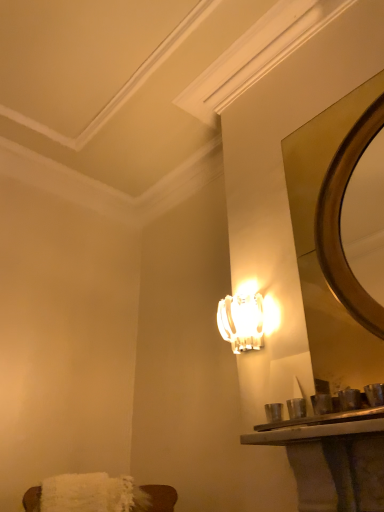
Find the location of a particular element. The width and height of the screenshot is (384, 512). clear glass sconce at upper right is located at coordinates (242, 321).

Image resolution: width=384 pixels, height=512 pixels. Describe the element at coordinates (242, 321) in the screenshot. I see `clear glass sconce at upper right` at that location.

Find the location of a particular element. clear glass sconce at upper right is located at coordinates (242, 321).